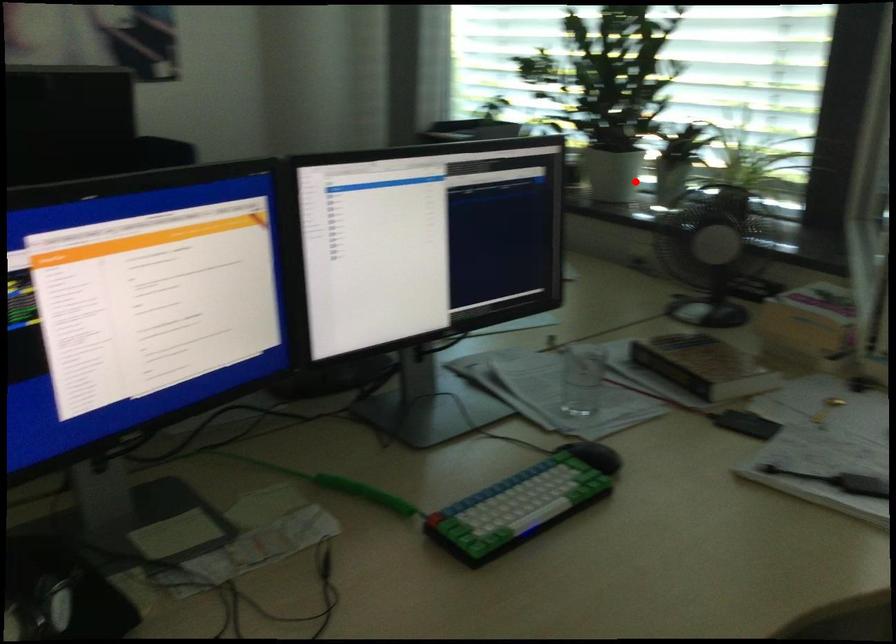
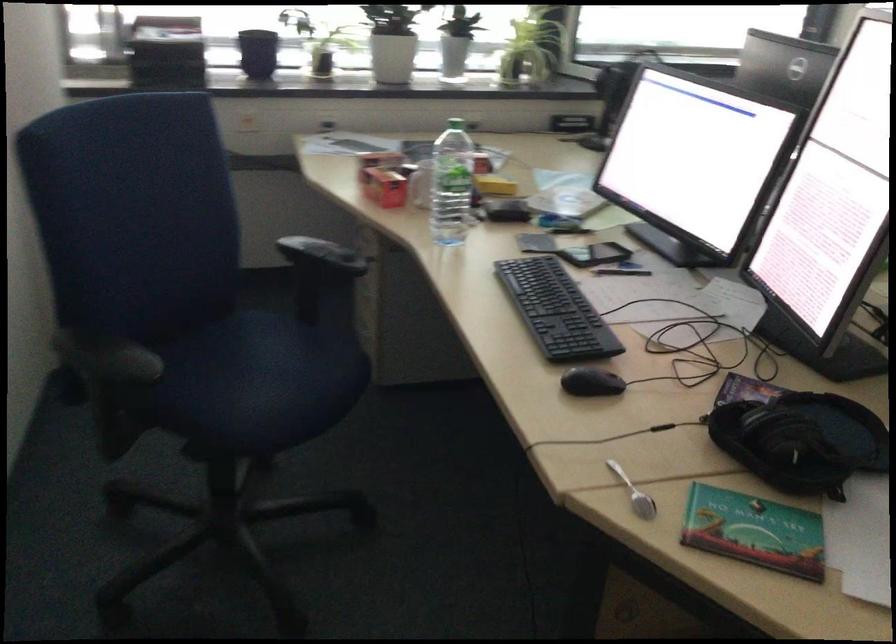
The point at the highlighted location is marked in the first image. Where is the corresponding point in the second image?

(392, 58)